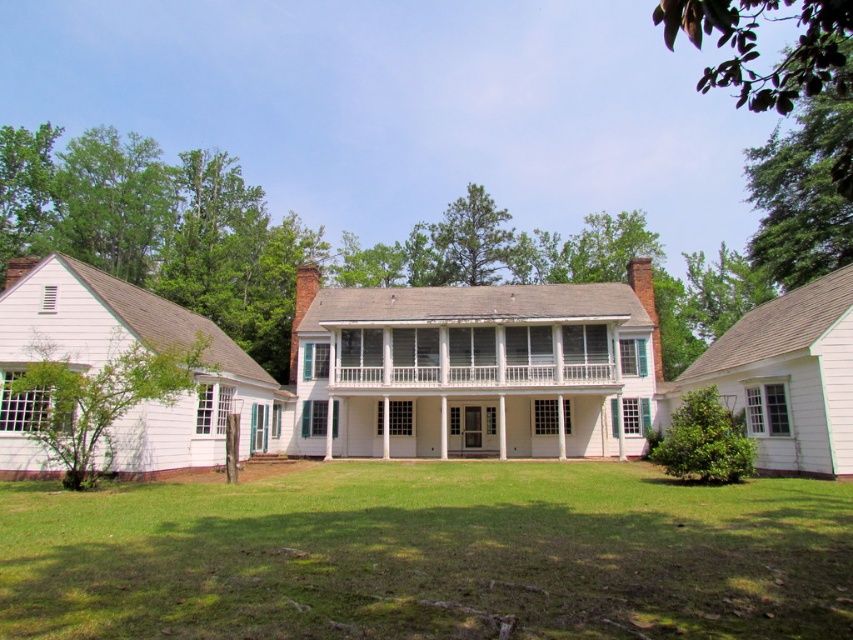
Question: Among these objects, which one is nearest to the camera?

Choices:
 (A) white painted wood porch at center
 (B) green grass at center

Answer: (B)

Question: Considering the relative positions of green grass at center and white painted wood porch at center in the image provided, where is green grass at center located with respect to white painted wood porch at center?

Choices:
 (A) above
 (B) below

Answer: (B)

Question: Can you confirm if green grass at center is positioned to the left of white painted wood porch at center?

Choices:
 (A) no
 (B) yes

Answer: (B)

Question: Among these objects, which one is farthest from the camera?

Choices:
 (A) white painted wood porch at center
 (B) green grass at center

Answer: (A)

Question: Is green grass at center above white painted wood porch at center?

Choices:
 (A) yes
 (B) no

Answer: (B)